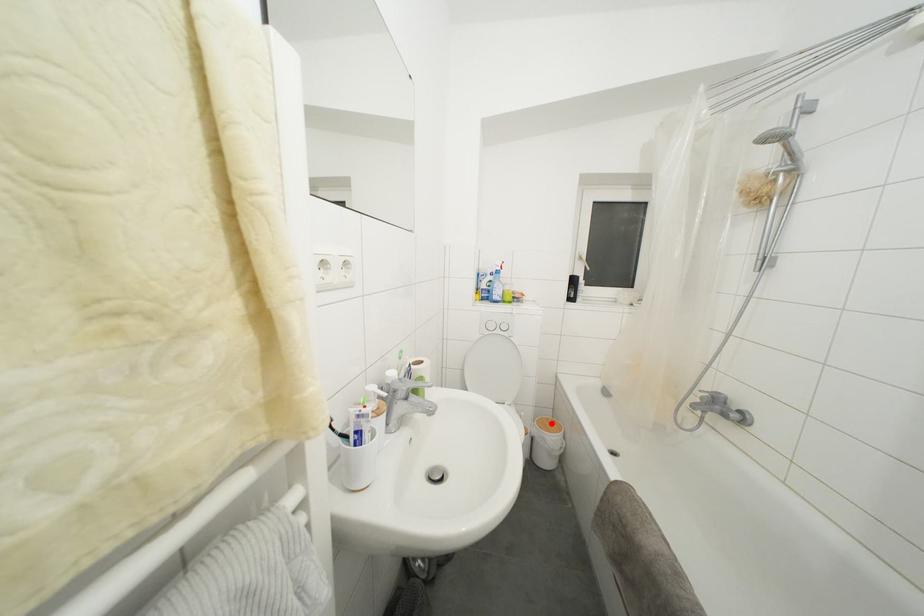
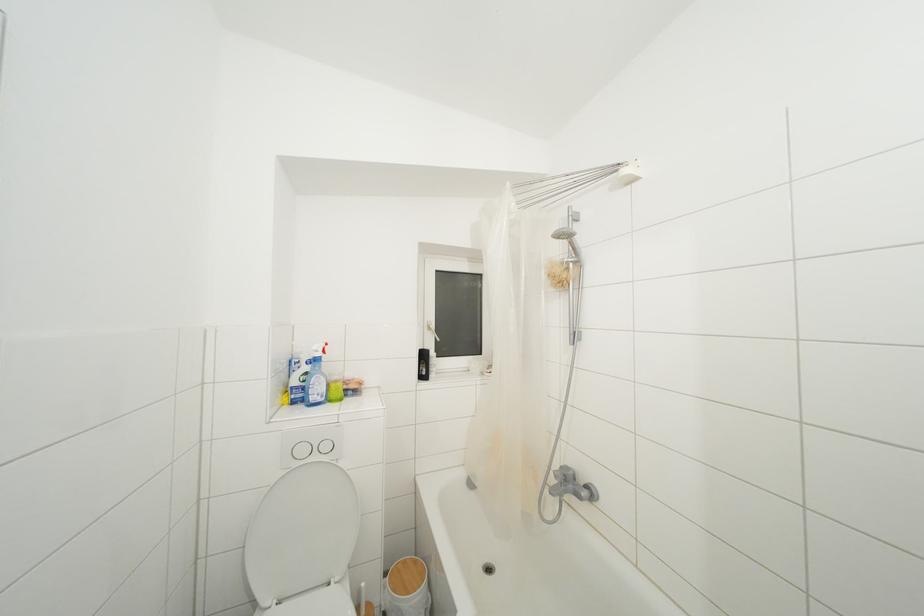
In the second image, find the point that corresponds to the highlighted location in the first image.

(408, 567)